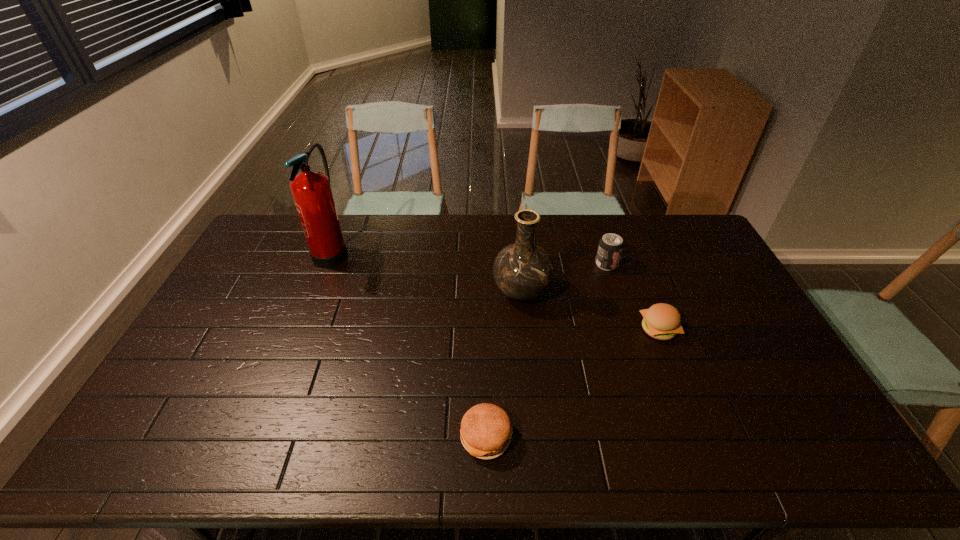
The height and width of the screenshot is (540, 960). Find the location of `the leftmost object`. the leftmost object is located at coordinates (311, 190).

Where is `fire extinguisher`? The image size is (960, 540). fire extinguisher is located at coordinates (311, 190).

Where is `vase`? This screenshot has height=540, width=960. vase is located at coordinates (523, 271).

The width and height of the screenshot is (960, 540). What are the coordinates of `soda can` in the screenshot? It's located at (610, 247).

Image resolution: width=960 pixels, height=540 pixels. Find the location of `the fourth tallest object`. the fourth tallest object is located at coordinates (661, 321).

Where is `the right hamburger`? the right hamburger is located at coordinates (661, 321).

The height and width of the screenshot is (540, 960). In order to click on the nearest object in this screenshot , I will do `click(486, 430)`.

This screenshot has height=540, width=960. In order to click on the left hamburger in this screenshot , I will do `click(486, 430)`.

This screenshot has height=540, width=960. In order to click on vacant space located on the left of the tallest object in this screenshot , I will do tap(252, 251).

Image resolution: width=960 pixels, height=540 pixels. Find the location of `vacant space located on the right of the vase`. vacant space located on the right of the vase is located at coordinates (651, 292).